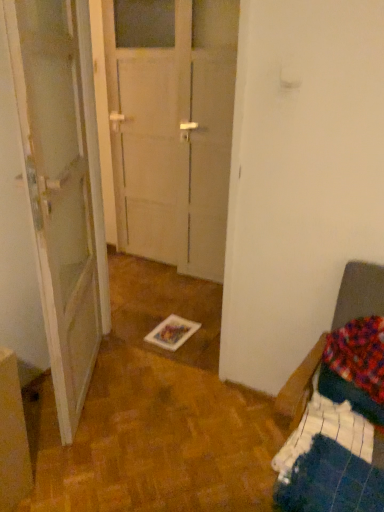
Identify the location of vacant space in front of white glossy door at left. This screenshot has width=384, height=512. (102, 457).